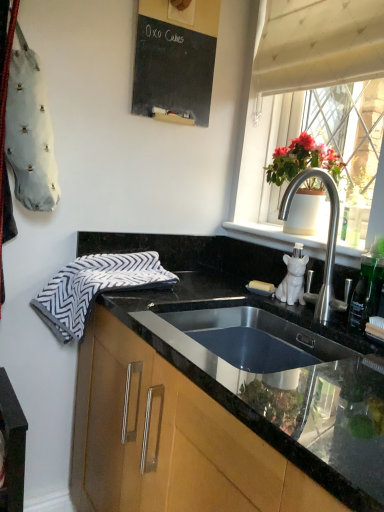
Question: Considering the positions of point (238, 236) and point (288, 224), is point (238, 236) closer or farther from the camera than point (288, 224)?

Choices:
 (A) farther
 (B) closer

Answer: (A)

Question: In terms of height, does white ceramic cat at right look taller or shorter compared to matte white pot at right?

Choices:
 (A) tall
 (B) short

Answer: (B)

Question: Which object is the closest to the white ceramic cat at right?

Choices:
 (A) white textured curtain at upper right
 (B) matte white pot at right
 (C) black chalkboard at upper center
 (D) wooden cabinet at lower center
 (E) translucent glass window at upper right

Answer: (B)

Question: Which of these objects is positioned farthest from the matte white pot at right?

Choices:
 (A) white textured curtain at upper right
 (B) translucent glass window at upper right
 (C) black chalkboard at upper center
 (D) white ceramic cat at right
 (E) gray and white zigzag-patterned hand towel at left

Answer: (E)